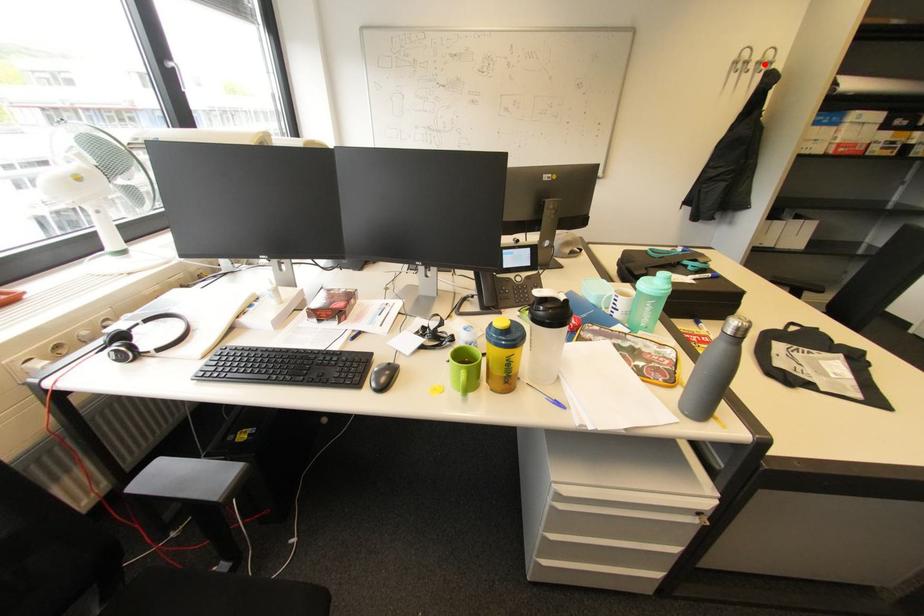
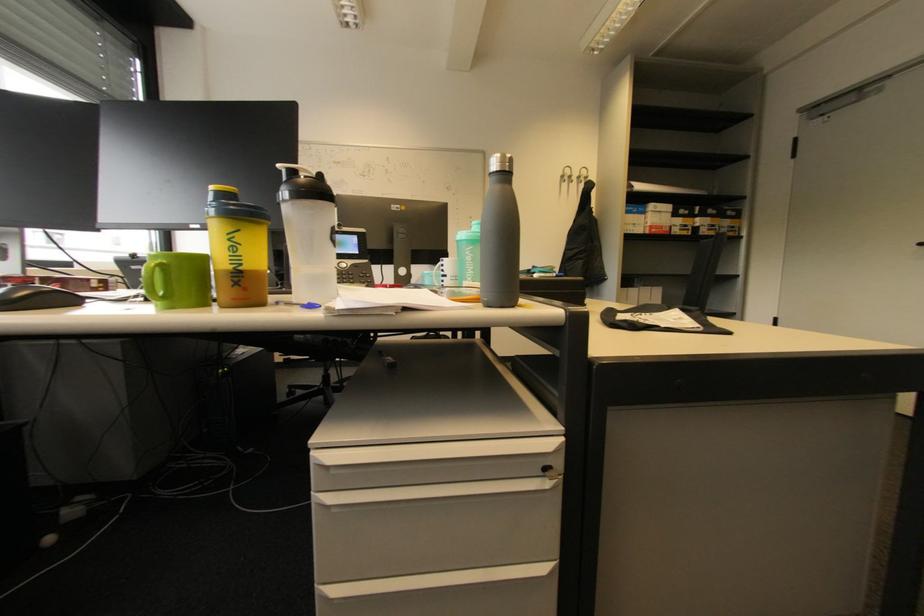
In the second image, find the point that corresponds to the highlighted location in the first image.

(584, 177)